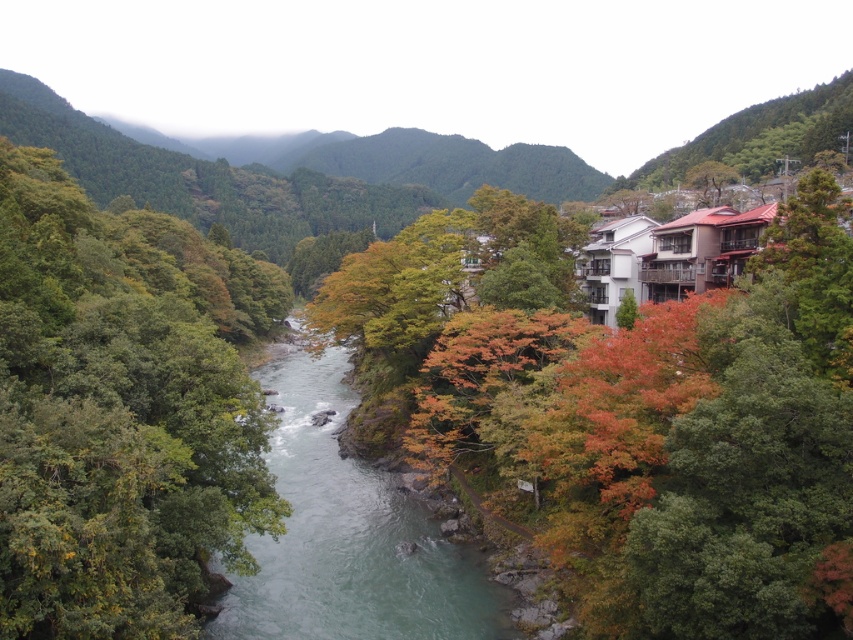
You are standing on the riverbank and see the autumn leaves at center and the green leafy trees at left. Which object is closer to you?

The autumn leaves at center are closer to you than the green leafy trees at left because they are positioned further to the viewer.

You are standing at the center of the river in the image. Which direction should you look to see the green leafy trees at left?

A: You should look to the left to see the green leafy trees at left, as they are located at point (120, 412) which is to the left of the center position.

You are an environmental scientist assessing the river ecosystem. You observe the green leafy trees at left and the clear water at center. Which object is taller?

The green leafy trees at left are taller than the clear water at center.